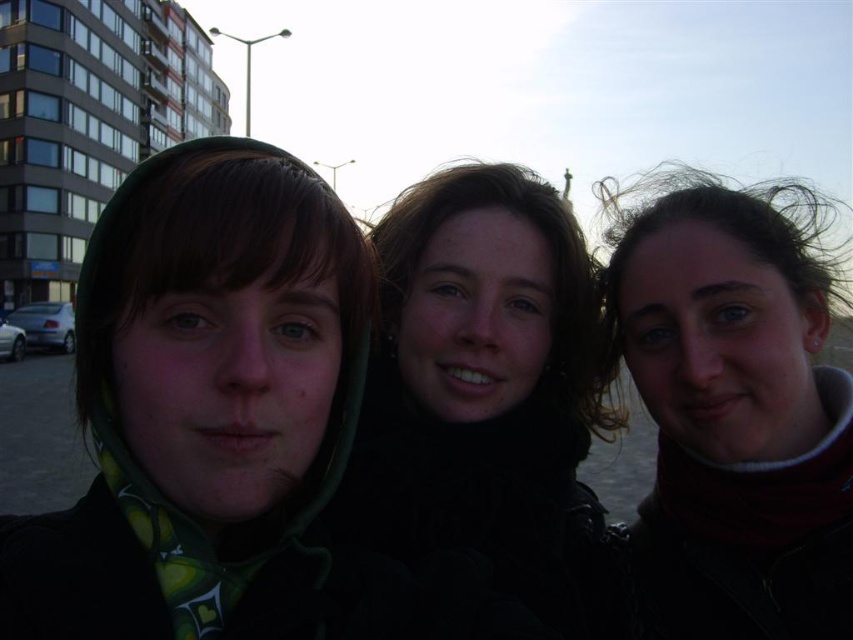
Question: Which object is farther from the camera taking this photo?

Choices:
 (A) black matte jacket at center
 (B) green fabric headscarf at left

Answer: (A)

Question: Considering the relative positions of green fabric headscarf at left and dark brown hair at right in the image provided, where is green fabric headscarf at left located with respect to dark brown hair at right?

Choices:
 (A) right
 (B) left

Answer: (B)

Question: Which object appears farthest from the camera in this image?

Choices:
 (A) dark brown hair at right
 (B) black matte jacket at center
 (C) green fabric headscarf at left

Answer: (A)

Question: Is green fabric headscarf at left below black matte jacket at center?

Choices:
 (A) yes
 (B) no

Answer: (A)

Question: Estimate the real-world distances between objects in this image. Which object is closer to the black matte jacket at center?

Choices:
 (A) dark brown hair at right
 (B) green fabric headscarf at left

Answer: (A)

Question: In this image, where is dark brown hair at right located relative to black matte jacket at center?

Choices:
 (A) above
 (B) below

Answer: (B)